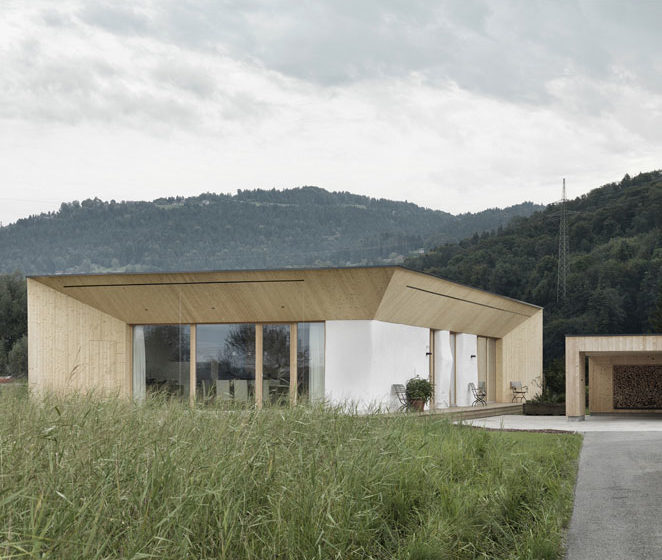
Locate an element on the screen. The width and height of the screenshot is (662, 560). large window is located at coordinates (232, 364), (173, 361), (277, 379), (307, 368).